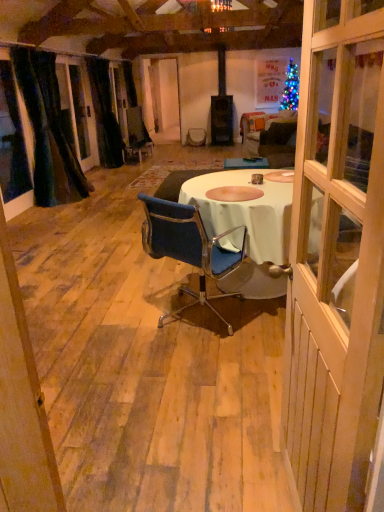
Question: Is black velvet curtain at left, positioned as the first curtain in back-to-front order, completely or partially inside blue fabric chair at center?

Choices:
 (A) no
 (B) yes

Answer: (A)

Question: From the image's perspective, would you say blue fabric chair at center is shown under black velvet curtain at left, the second curtain from the front?

Choices:
 (A) no
 (B) yes

Answer: (B)

Question: Can you confirm if blue fabric chair at center is bigger than black velvet curtain at left, positioned as the first curtain in back-to-front order?

Choices:
 (A) no
 (B) yes

Answer: (A)

Question: Can we say blue fabric chair at center lies outside black velvet curtain at left, the second curtain from the front?

Choices:
 (A) yes
 (B) no

Answer: (A)

Question: Does blue fabric chair at center have a lesser width compared to black velvet curtain at left, positioned as the first curtain in back-to-front order?

Choices:
 (A) no
 (B) yes

Answer: (A)

Question: Considering the relative positions of blue fabric chair at center and black velvet curtain at left, positioned as the first curtain in back-to-front order, in the image provided, is blue fabric chair at center in front of black velvet curtain at left, positioned as the first curtain in back-to-front order,?

Choices:
 (A) yes
 (B) no

Answer: (A)

Question: Is black velvet curtain at left, positioned as the first curtain in back-to-front order, far away from blue fabric chair at center?

Choices:
 (A) yes
 (B) no

Answer: (A)

Question: Is black velvet curtain at left, positioned as the first curtain in back-to-front order, outside blue fabric chair at center?

Choices:
 (A) no
 (B) yes

Answer: (B)

Question: Can you confirm if black velvet curtain at left, the second curtain from the front, is smaller than blue fabric chair at center?

Choices:
 (A) yes
 (B) no

Answer: (B)

Question: Is black velvet curtain at left, positioned as the first curtain in back-to-front order, directly adjacent to blue fabric chair at center?

Choices:
 (A) no
 (B) yes

Answer: (A)

Question: Is black velvet curtain at left, the second curtain from the front, closer to camera compared to blue fabric chair at center?

Choices:
 (A) yes
 (B) no

Answer: (B)

Question: Considering the relative sizes of black velvet curtain at left, positioned as the first curtain in back-to-front order, and blue fabric chair at center in the image provided, is black velvet curtain at left, positioned as the first curtain in back-to-front order, taller than blue fabric chair at center?

Choices:
 (A) no
 (B) yes

Answer: (B)

Question: Does wooden door at center appear on the left side of blue fabric chair at center?

Choices:
 (A) no
 (B) yes

Answer: (A)